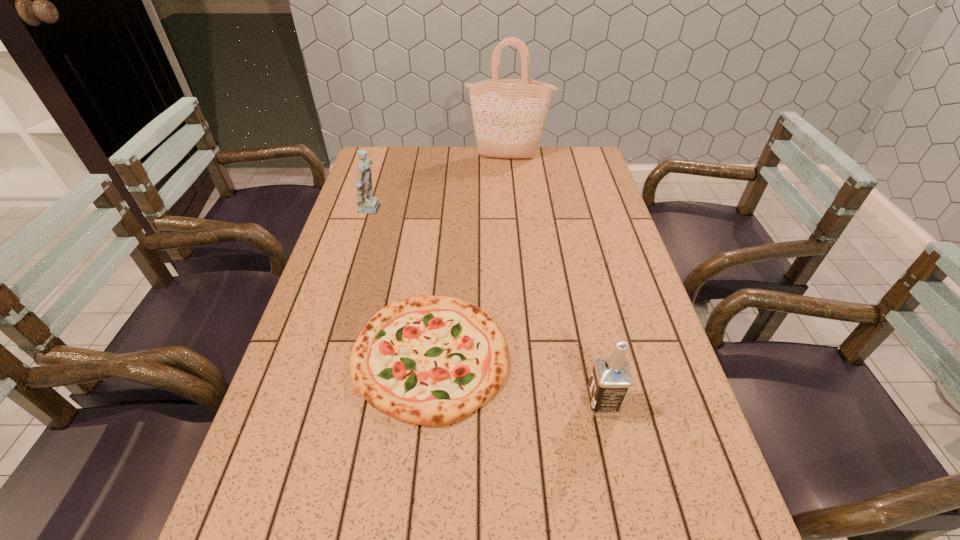
You are a GUI agent. You are given a task and a screenshot of the screen. Output one action in this format:
    pyautogui.click(x=<x>, y=<y>)
    Task: Click on the free location located 0.370m on the front label of the vodka
    The image size is (960, 540).
    Given the screenshot: What is the action you would take?
    pyautogui.click(x=408, y=403)

Find the location of a particular element. The image size is (960, 540). vacant region located 0.110m on the front of the shortest object is located at coordinates (418, 485).

The height and width of the screenshot is (540, 960). Identify the location of object that is at the far edge. (508, 114).

At what (x,y) coordinates should I click in order to perform the action: click on figurine present at the left edge. Please return your answer as a coordinate pair (x, y). This screenshot has width=960, height=540. Looking at the image, I should click on (366, 202).

Identify the location of pizza positioned at the left edge. The width and height of the screenshot is (960, 540). (430, 360).

Where is `object that is at the right edge`? The height and width of the screenshot is (540, 960). object that is at the right edge is located at coordinates (610, 380).

You are a GUI agent. You are given a task and a screenshot of the screen. Output one action in this format:
    pyautogui.click(x=<x>, y=<y>)
    Task: Click on the free space at the far edge of the desktop
    
    Given the screenshot: What is the action you would take?
    pyautogui.click(x=424, y=171)

Identify the location of free space at the left edge. The width and height of the screenshot is (960, 540). (330, 484).

Where is `vacant region at the right edge`? The height and width of the screenshot is (540, 960). vacant region at the right edge is located at coordinates (680, 393).

Image resolution: width=960 pixels, height=540 pixels. In the image, there is a desktop. What are the coordinates of `vacant space at the far left corner` in the screenshot? It's located at pyautogui.click(x=373, y=173).